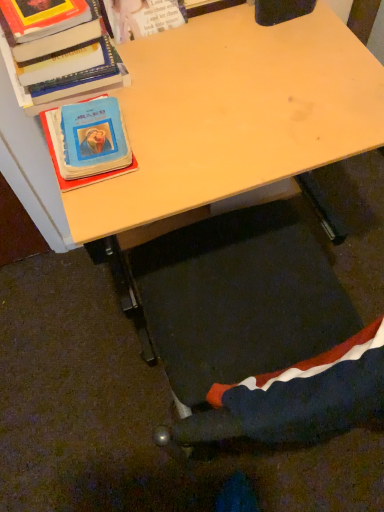
Find the location of a particular element. This screenshot has width=384, height=512. vacant area on top of wooden desk at center (from a real-world perspective) is located at coordinates (218, 81).